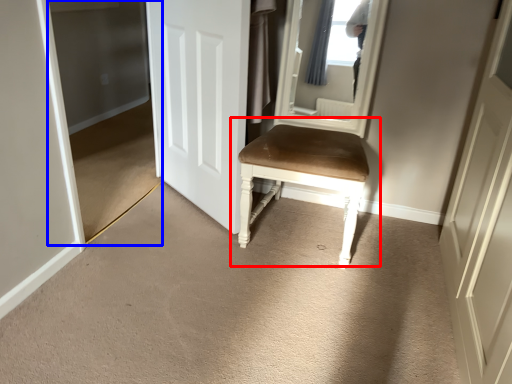
Question: Which object is closer to the camera taking this photo, chair (highlighted by a red box) or glass door (highlighted by a blue box)?

Choices:
 (A) chair
 (B) glass door

Answer: (A)